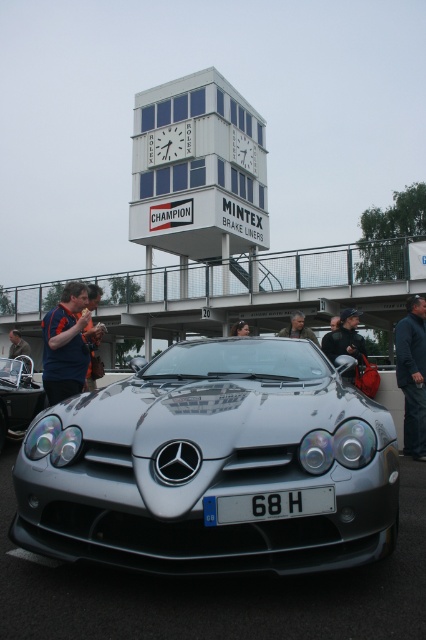
Question: Estimate the real-world distances between objects in this image. Which object is closer to the silver metallic car at center?

Choices:
 (A) smooth leather jacket at center
 (B) matte black jacket at center
 (C) sleek metallic car at center
 (D) white concrete clock tower at upper center

Answer: (C)

Question: Which of the following is the farthest from the observer?

Choices:
 (A) metallic gray overpass at center
 (B) white plastic license plate at center
 (C) blue shirt at left
 (D) matte black jacket at left

Answer: (A)

Question: Does sleek metallic car at center have a lesser width compared to matte black jacket at center?

Choices:
 (A) yes
 (B) no

Answer: (B)

Question: Can you confirm if sleek metallic car at center is bigger than matte blue shirt at left?

Choices:
 (A) yes
 (B) no

Answer: (B)

Question: Which object is the closest to the matte black jacket at center?

Choices:
 (A) smooth leather jacket at center
 (B) silver metallic car at center
 (C) matte black jacket at left

Answer: (C)

Question: Does dark blue fabric jacket at lower right come behind matte black jacket at left?

Choices:
 (A) no
 (B) yes

Answer: (B)